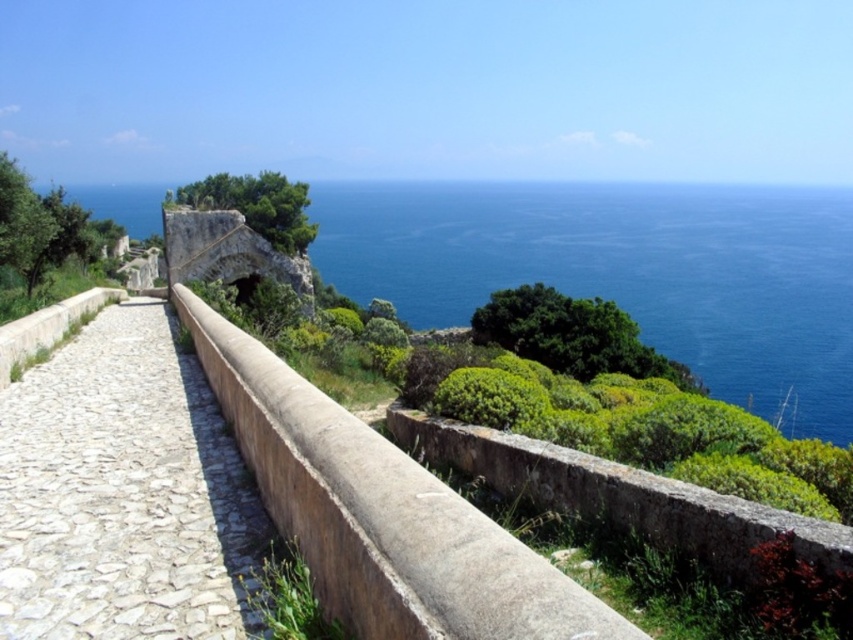
Consider the image. You are standing on the coastal pathway and want to reach the stone wall. Which direction should you move from the point at point (123, 492) to reach it?

The point at point (123, 492) is located on the stone paved path at left. To reach the stone wall, you should move towards the right side of the path since the wall is on one side of the pathway.